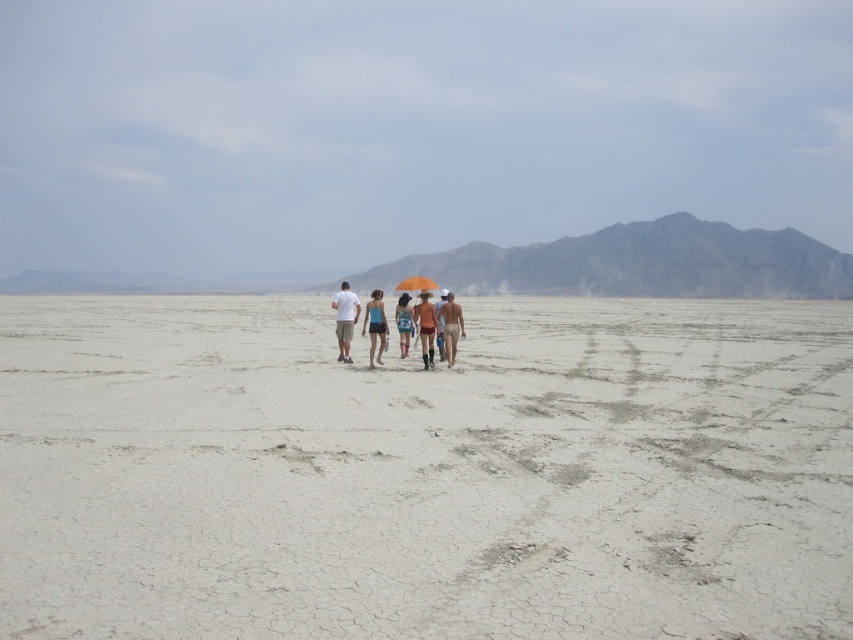
Between white cotton shirt at center and tan skin person at center, which one has more height?

With more height is white cotton shirt at center.

Does white cotton shirt at center appear under tan skin person at center?

Correct, white cotton shirt at center is located below tan skin person at center.

The width and height of the screenshot is (853, 640). I want to click on white cotton shirt at center, so click(345, 320).

This screenshot has width=853, height=640. In order to click on white cotton shirt at center in this screenshot , I will do `click(345, 320)`.

Can you confirm if tan skin person at center is positioned below orange matte umbrella at center?

Correct, tan skin person at center is located below orange matte umbrella at center.

Between tan skin person at center and orange matte umbrella at center, which one appears on the right side from the viewer's perspective?

tan skin person at center is more to the right.

Who is more distant from viewer, (451,305) or (434,285)?

Point (434,285)

Locate an element on the screen. The image size is (853, 640). tan skin person at center is located at coordinates (450, 326).

Who is shorter, white cracked dirt at center or white cotton shirt at center?

Standing shorter between the two is white cracked dirt at center.

Locate an element on the screen. Image resolution: width=853 pixels, height=640 pixels. white cracked dirt at center is located at coordinates (425, 472).

The image size is (853, 640). I want to click on white cracked dirt at center, so click(x=425, y=472).